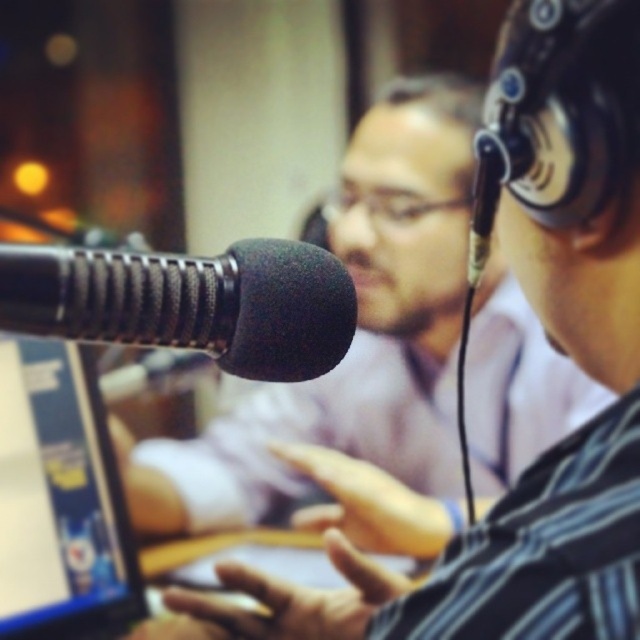
Describe the element at coordinates (189, 301) in the screenshot. The image size is (640, 640). I see `black fabric microphone at left` at that location.

Between black fabric microphone at left and black foam microphone at center, which one has less height?

With less height is black fabric microphone at left.

This screenshot has height=640, width=640. I want to click on black fabric microphone at left, so click(x=189, y=301).

Can you confirm if black fabric microphone at left is wider than matte plastic laptop at left?

Yes.

Is point (134, 260) less distant than point (104, 513)?

Yes, it is.

Locate an element on the screen. This screenshot has height=640, width=640. black fabric microphone at left is located at coordinates (189, 301).

Where is `black fabric microphone at left`? This screenshot has height=640, width=640. black fabric microphone at left is located at coordinates (189, 301).

Is matte plastic laptop at left shorter than black foam microphone at center?

Incorrect, matte plastic laptop at left's height does not fall short of black foam microphone at center's.

Does matte plastic laptop at left appear over black foam microphone at center?

Incorrect, matte plastic laptop at left is not positioned above black foam microphone at center.

Describe the element at coordinates (60, 499) in the screenshot. I see `matte plastic laptop at left` at that location.

Identify the location of matte plastic laptop at left. This screenshot has width=640, height=640. [60, 499].